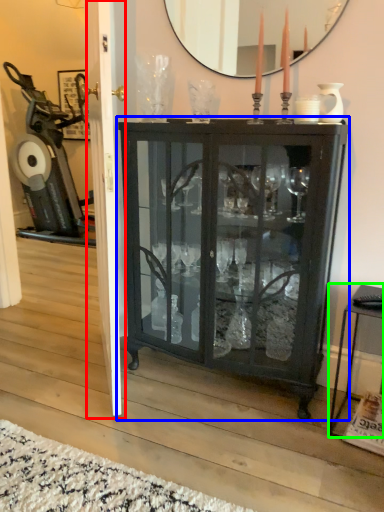
Question: Estimate the real-world distances between objects in this image. Which object is closer to screen door (highlighted by a red box), cupboard (highlighted by a blue box) or table (highlighted by a green box)?

Choices:
 (A) cupboard
 (B) table

Answer: (A)